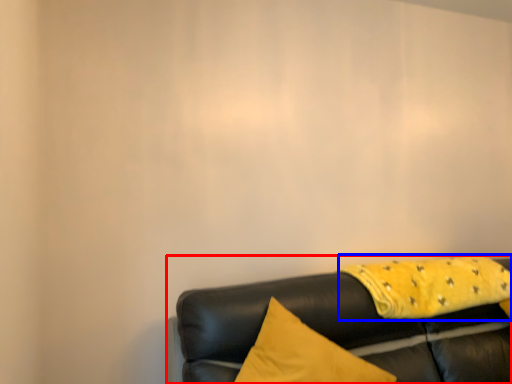
Question: Which object is further to the camera taking this photo, studio couch (highlighted by a red box) or blanket (highlighted by a blue box)?

Choices:
 (A) studio couch
 (B) blanket

Answer: (B)